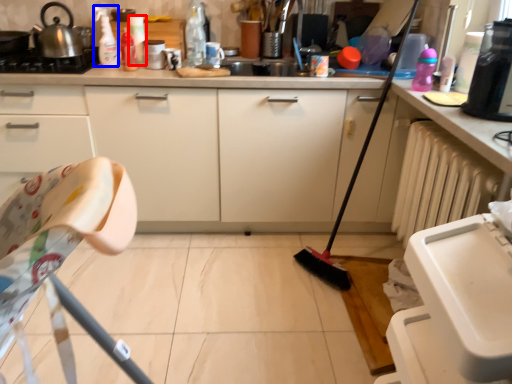
Question: Among these objects, which one is nearest to the camera, bottle (highlighted by a red box) or cleaning product (highlighted by a blue box)?

Choices:
 (A) bottle
 (B) cleaning product

Answer: (B)